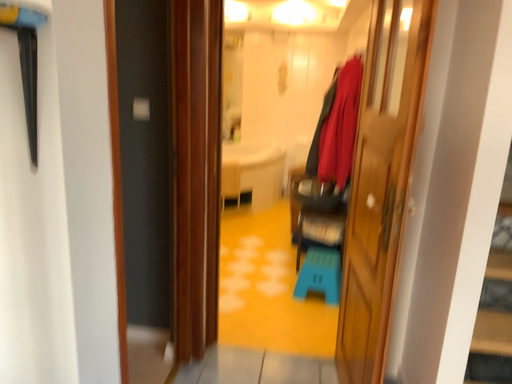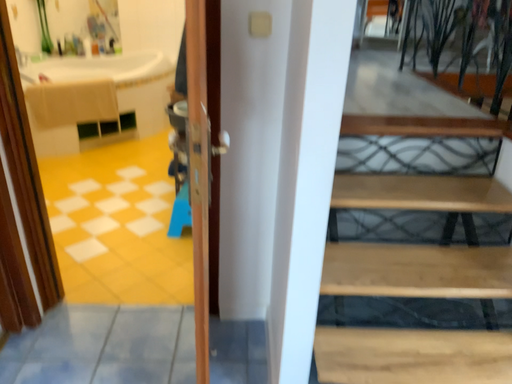
Question: How did the camera likely rotate when shooting the video?

Choices:
 (A) rotated downward
 (B) rotated upward

Answer: (A)